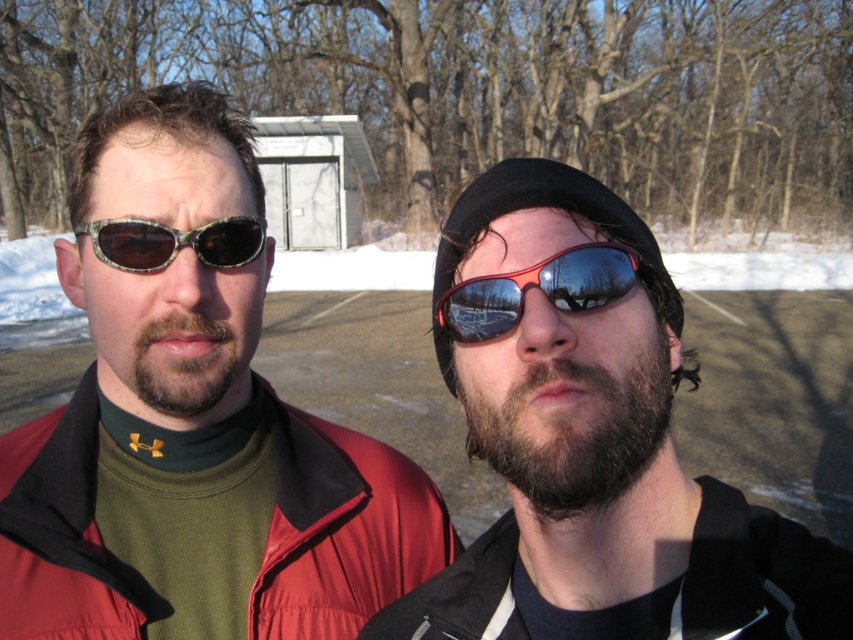
Question: Which of the following is the closest to the observer?

Choices:
 (A) matte black jacket at left
 (B) camouflage-patterned sunglasses at left
 (C) black fleece jacket at lower right
 (D) shiny red plastic goggles at center

Answer: (C)

Question: Which object is positioned farthest from the camouflage-patterned sunglasses at left?

Choices:
 (A) shiny red plastic goggles at center
 (B) black fleece jacket at lower right
 (C) shiny reflective sunglasses at center
 (D) matte black jacket at left

Answer: (B)

Question: Which of the following is the farthest from the observer?

Choices:
 (A) matte black jacket at left
 (B) shiny red plastic goggles at center
 (C) shiny reflective sunglasses at center
 (D) black fleece jacket at lower right

Answer: (A)

Question: Where is shiny reflective sunglasses at center located in relation to black fleece jacket at lower right in the image?

Choices:
 (A) left
 (B) right

Answer: (B)

Question: Is black fleece jacket at lower right smaller than camouflage-patterned sunglasses at left?

Choices:
 (A) yes
 (B) no

Answer: (B)

Question: Is shiny reflective sunglasses at center positioned at the back of camouflage-patterned sunglasses at left?

Choices:
 (A) no
 (B) yes

Answer: (A)